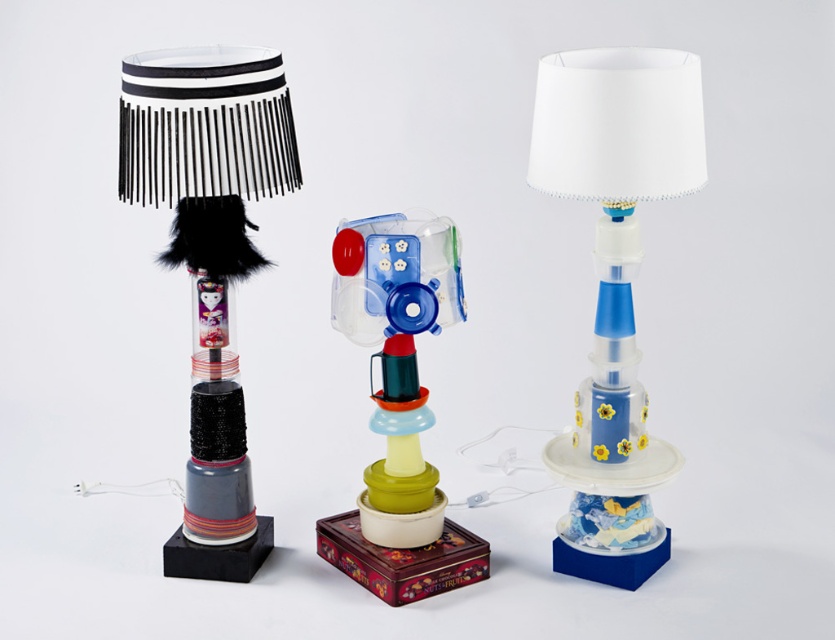
Question: Does blue glossy lampshade at center come in front of black fabric lampshade at left?

Choices:
 (A) yes
 (B) no

Answer: (B)

Question: In this image, where is blue glossy lampshade at center located relative to black fabric lampshade at left?

Choices:
 (A) above
 (B) below

Answer: (A)

Question: Estimate the real-world distances between objects in this image. Which object is closer to the black fabric lampshade at left?

Choices:
 (A) blue glossy lampshade at center
 (B) translucent plastic toy at center

Answer: (B)

Question: Can you confirm if blue glossy lampshade at center is positioned above translucent plastic toy at center?

Choices:
 (A) yes
 (B) no

Answer: (A)

Question: Estimate the real-world distances between objects in this image. Which object is closer to the translucent plastic toy at center?

Choices:
 (A) black fabric lampshade at left
 (B) blue glossy lampshade at center

Answer: (A)

Question: Which point appears closest to the camera in this image?

Choices:
 (A) [x=433, y=547]
 (B) [x=211, y=252]

Answer: (B)